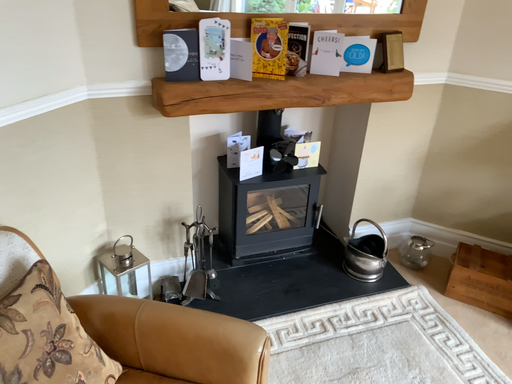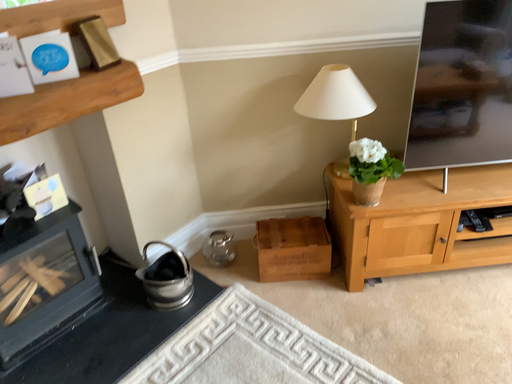
Question: How did the camera likely rotate when shooting the video?

Choices:
 (A) rotated left
 (B) rotated right

Answer: (B)